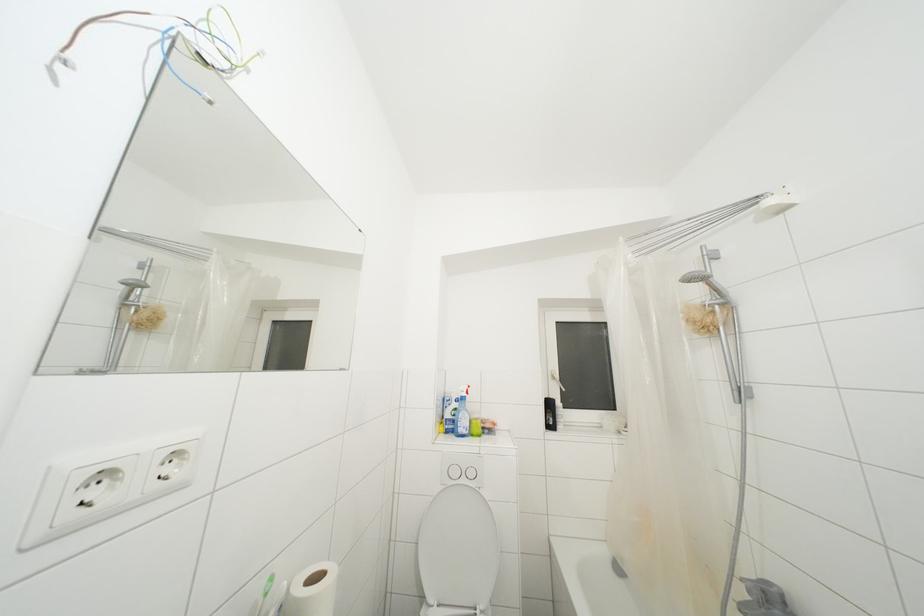
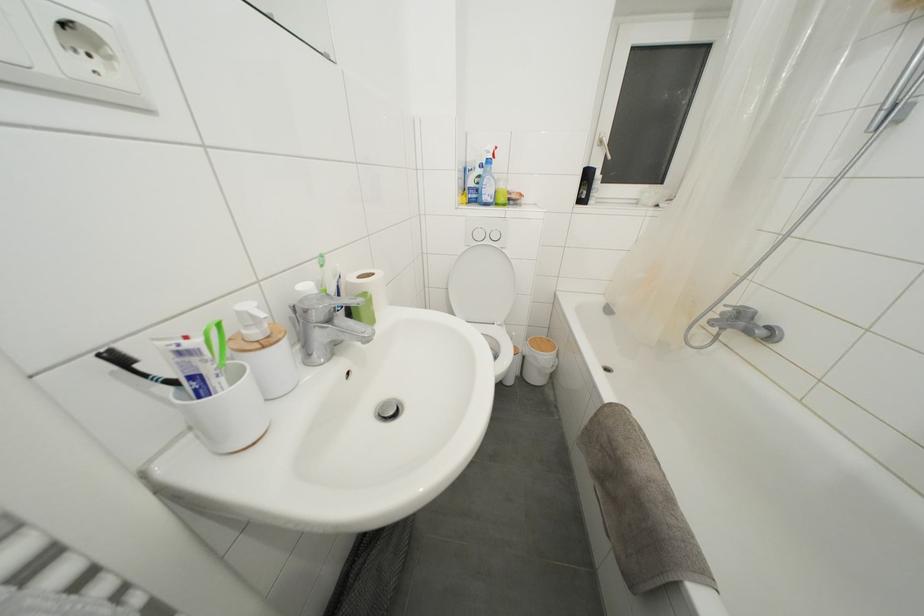
Question: Based on the continuous images, in which direction is the camera rotating? Reply with the corresponding letter.

Choices:
 (A) Left
 (B) Right
 (C) Up
 (D) Down

Answer: (D)